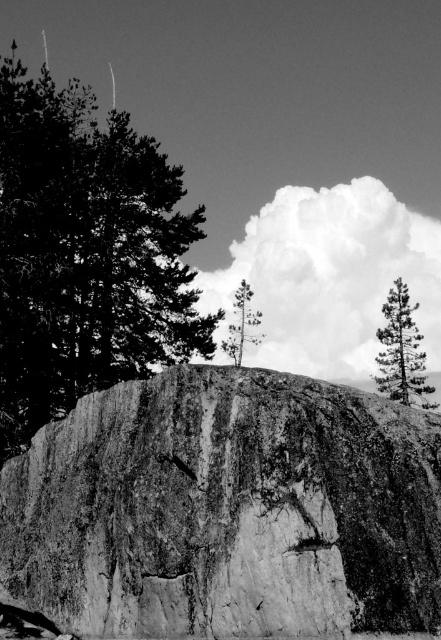
You are a hiker trying to navigate through the forest in the image. You need to find the smooth green tree at center. Which direction should you go from the smooth bark tree at upper right to reach it?

The smooth bark tree at upper right is located below the smooth green tree at center, so you should go upwards from the smooth bark tree at upper right to reach the smooth green tree at center.

You are a hiker standing at the base of the granite rock at center. You want to walk towards the smooth green tree at center. Which direction should you head?

The granite rock at center is to the left of the smooth green tree at center, so you should head to the right to reach it.